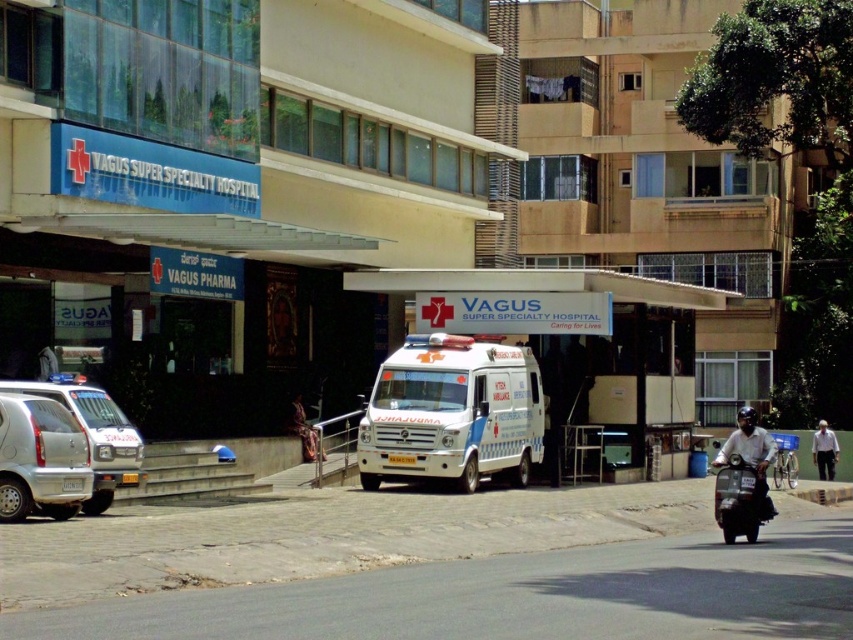
Question: Among these objects, which one is farthest from the camera?

Choices:
 (A) white cotton shirt at lower right
 (B) shiny black scooter at lower right
 (C) white glossy ambulance at center
 (D) dark gray helmeted head at lower right

Answer: (A)

Question: Is dark gray helmeted head at lower right wider than white cotton shirt at lower right?

Choices:
 (A) no
 (B) yes

Answer: (B)

Question: Among these objects, which one is nearest to the camera?

Choices:
 (A) white cotton shirt at lower right
 (B) silver metallic van at left
 (C) white glossy ambulance at center

Answer: (B)

Question: Considering the real-world distances, which object is farthest from the silver metallic van at left?

Choices:
 (A) white glossy ambulance at center
 (B) shiny black scooter at lower right
 (C) white cotton shirt at lower right
 (D) dark gray helmeted head at lower right

Answer: (C)

Question: Can you confirm if white glossy ambulance at center is smaller than dark gray helmeted head at lower right?

Choices:
 (A) yes
 (B) no

Answer: (A)

Question: Does shiny black scooter at lower right appear on the left side of white cotton shirt at lower right?

Choices:
 (A) no
 (B) yes

Answer: (B)